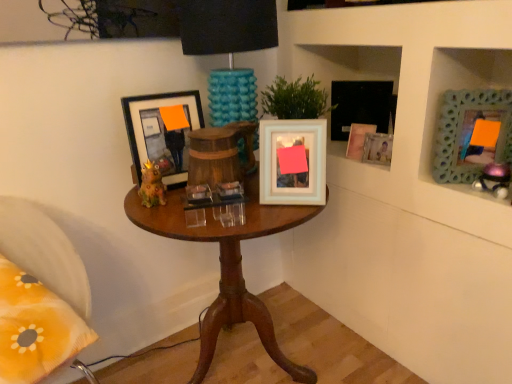
What do you see at coordinates (227, 26) in the screenshot?
I see `teal textured lampshade at center` at bounding box center [227, 26].

What is the approximate height of teal textured lampshade at center?

teal textured lampshade at center is 21.93 inches in height.

What is the approximate height of white glossy picture frame at center, arranged as the fifth picture frame when viewed from the right?

white glossy picture frame at center, arranged as the fifth picture frame when viewed from the right, is 28.22 centimeters tall.

Consider the image. Measure the distance between point (297, 193) and camera.

1.17 meters.

Where is `yellow fabric pillow at lower left`? This screenshot has width=512, height=384. yellow fabric pillow at lower left is located at coordinates (35, 328).

The image size is (512, 384). I want to click on matte white picture frame at upper right, the 3th picture frame viewed from the left, so click(x=358, y=140).

In order to face matte white picture frame at upper right, the 4th picture frame when ordered from right to left, should I rotate leftwards or rightwards?

You should look right and rotate roughly 13.861 degrees.

How much space does matte black picture frame at left, the 6th picture frame viewed from the right, occupy vertically?

11.04 inches.

Image resolution: width=512 pixels, height=384 pixels. What do you see at coordinates (151, 185) in the screenshot?
I see `matte ceramic frog at center, the first toy in the left-to-right sequence` at bounding box center [151, 185].

Locate an element on the screen. teal textured lampshade at center is located at coordinates (227, 26).

Which is more distant, [510,221] or [387,159]?

The point [387,159] is more distant.

From the image's perspective, is white textured cabinet at upper right above matte white picture frame at upper right, the second picture frame from the right?

No.

Is white textured cabinet at upper right looking in the opposite direction of matte white picture frame at upper right, which is the 5th picture frame in left-to-right order?

Yes, white textured cabinet at upper right is positioned with its back facing matte white picture frame at upper right, which is the 5th picture frame in left-to-right order.

Would you consider white textured cabinet at upper right to be distant from matte white picture frame at upper right, which is the 5th picture frame in left-to-right order?

No, white textured cabinet at upper right is not far away from matte white picture frame at upper right, which is the 5th picture frame in left-to-right order.

Which is closer, [239,285] or [161,201]?

The point [161,201] is in front.

Looking at their sizes, would you say wooden table at center is wider or thinner than matte ceramic frog at center, the first toy in the left-to-right sequence?

Clearly, wooden table at center has more width compared to matte ceramic frog at center, the first toy in the left-to-right sequence.

Does wooden table at center come in front of matte ceramic frog at center, arranged as the 2th toy when viewed from the right?

Yes, the depth of wooden table at center is less than that of matte ceramic frog at center, arranged as the 2th toy when viewed from the right.

Between yellow fabric pillow at lower left and matte black picture frame at left, the first picture frame positioned from the left, which one has larger size?

With larger size is yellow fabric pillow at lower left.

Between yellow fabric pillow at lower left and matte black picture frame at left, the first picture frame positioned from the left, which one has larger width?

yellow fabric pillow at lower left is wider.

Would you say yellow fabric pillow at lower left contains matte black picture frame at left, the first picture frame positioned from the left?

No.

Looking at this image, how far apart are yellow fabric pillow at lower left and matte black picture frame at left, the 6th picture frame viewed from the right?

yellow fabric pillow at lower left is 19.93 inches from matte black picture frame at left, the 6th picture frame viewed from the right.

In the scene shown: Which of these two, matte ceramic frog at center, arranged as the 2th toy when viewed from the right, or matte white picture frame at upper right, which is the 5th picture frame in left-to-right order, is smaller?

Smaller between the two is matte white picture frame at upper right, which is the 5th picture frame in left-to-right order.

Considering the sizes of objects matte ceramic frog at center, arranged as the 2th toy when viewed from the right, and matte white picture frame at upper right, the second picture frame from the right, in the image provided, who is shorter, matte ceramic frog at center, arranged as the 2th toy when viewed from the right, or matte white picture frame at upper right, the second picture frame from the right,?

Standing shorter between the two is matte white picture frame at upper right, the second picture frame from the right.

What are the coordinates of `toy to the left of matte white picture frame at upper right, the second picture frame from the right` in the screenshot? It's located at (151, 185).

Consider the image. Is the position of yellow fabric pillow at lower left less distant than that of matte ceramic frog at center, the first toy in the left-to-right sequence?

That is True.

Considering the relative sizes of yellow fabric pillow at lower left and matte ceramic frog at center, the first toy in the left-to-right sequence, in the image provided, is yellow fabric pillow at lower left smaller than matte ceramic frog at center, the first toy in the left-to-right sequence,?

Actually, yellow fabric pillow at lower left might be larger than matte ceramic frog at center, the first toy in the left-to-right sequence.

Can you confirm if yellow fabric pillow at lower left is positioned to the right of matte ceramic frog at center, arranged as the 2th toy when viewed from the right?

In fact, yellow fabric pillow at lower left is to the left of matte ceramic frog at center, arranged as the 2th toy when viewed from the right.

Who is smaller, white glossy picture frame at center, positioned as the second picture frame in left-to-right order, or metallic purple toy at upper right, placed as the first toy when sorted from right to left?

Smaller between the two is metallic purple toy at upper right, placed as the first toy when sorted from right to left.

From the image's perspective, which one is positioned higher, white glossy picture frame at center, positioned as the second picture frame in left-to-right order, or metallic purple toy at upper right, the second toy viewed from the left?

white glossy picture frame at center, positioned as the second picture frame in left-to-right order.

Considering the points (263, 188) and (499, 179), which point is behind, point (263, 188) or point (499, 179)?

The point (263, 188) is farther.

From the image's perspective, which is below, matte white picture frame at upper right, which is the 5th picture frame in left-to-right order, or wooden table at center?

From the image's view, wooden table at center is below.

Which is closer, (379,153) or (225,240)?

Point (379,153) is positioned farther from the camera compared to point (225,240).

Is matte white picture frame at upper right, which is the 5th picture frame in left-to-right order, looking in the opposite direction of wooden table at center?

matte white picture frame at upper right, which is the 5th picture frame in left-to-right order, is not turned away from wooden table at center.

In terms of width, does matte white picture frame at upper right, which is the 5th picture frame in left-to-right order, look wider or thinner when compared to wooden table at center?

In the image, matte white picture frame at upper right, which is the 5th picture frame in left-to-right order, appears to be more narrow than wooden table at center.

I want to click on picture frame that is the 4th one when counting backward from the white textured cabinet at upper right, so click(x=378, y=148).

Where is `table below the matte ceramic frog at center, the first toy in the left-to-right sequence (from the image's perspective)`? The width and height of the screenshot is (512, 384). table below the matte ceramic frog at center, the first toy in the left-to-right sequence (from the image's perspective) is located at coordinates pyautogui.click(x=228, y=266).

When comparing their distances from white glossy picture frame at center, positioned as the second picture frame in left-to-right order, does wooden table at center or matte white picture frame at upper right, which is the 5th picture frame in left-to-right order, seem closer?

wooden table at center lies closer to white glossy picture frame at center, positioned as the second picture frame in left-to-right order, than the other object.

Estimate the real-world distances between objects in this image. Which object is closer to matte white picture frame at upper right, the second picture frame from the right, matte black picture frame at upper right, which is the fourth picture frame in left-to-right order, or white textured cabinet at upper right?

Based on the image, matte black picture frame at upper right, which is the fourth picture frame in left-to-right order, appears to be nearer to matte white picture frame at upper right, the second picture frame from the right.

Based on the photo, based on their spatial positions, is matte black picture frame at left, the 6th picture frame viewed from the right, or matte ceramic frog at center, the first toy in the left-to-right sequence, further from green textured frame at upper right, the 1th picture frame when ordered from right to left?

matte ceramic frog at center, the first toy in the left-to-right sequence.

Which object lies further to the anchor point matte black picture frame at left, the first picture frame positioned from the left, metallic purple toy at upper right, placed as the first toy when sorted from right to left, or matte white picture frame at upper right, which is the 5th picture frame in left-to-right order?

Among the two, metallic purple toy at upper right, placed as the first toy when sorted from right to left, is located further to matte black picture frame at left, the first picture frame positioned from the left.

When comparing their distances from green textured frame at upper right, marked as the sixth picture frame in a left-to-right arrangement, does matte white picture frame at upper right, the 3th picture frame viewed from the left, or white textured cabinet at upper right seem further?

matte white picture frame at upper right, the 3th picture frame viewed from the left, lies further to green textured frame at upper right, marked as the sixth picture frame in a left-to-right arrangement, than the other object.

When comparing their distances from matte ceramic frog at center, arranged as the 2th toy when viewed from the right, does wooden table at center or matte black picture frame at left, the first picture frame positioned from the left, seem closer?

matte black picture frame at left, the first picture frame positioned from the left, is positioned closer to the anchor matte ceramic frog at center, arranged as the 2th toy when viewed from the right.

Which object lies further to the anchor point teal textured lampshade at center, metallic purple toy at upper right, placed as the first toy when sorted from right to left, or matte ceramic frog at center, the first toy in the left-to-right sequence?

metallic purple toy at upper right, placed as the first toy when sorted from right to left, is positioned further to the anchor teal textured lampshade at center.

From the image, which object appears to be nearer to green textured frame at upper right, the 1th picture frame when ordered from right to left, matte white picture frame at upper right, the 4th picture frame when ordered from right to left, or metallic purple toy at upper right, the second toy viewed from the left?

Based on the image, metallic purple toy at upper right, the second toy viewed from the left, appears to be nearer to green textured frame at upper right, the 1th picture frame when ordered from right to left.

Find the location of a particular element. Image resolution: width=512 pixels, height=384 pixels. table located between yellow fabric pillow at lower left and white glossy picture frame at center, positioned as the second picture frame in left-to-right order, in the left-right direction is located at coordinates (228, 266).

Locate an element on the screen. The height and width of the screenshot is (384, 512). toy between yellow fabric pillow at lower left and white glossy picture frame at center, positioned as the second picture frame in left-to-right order is located at coordinates (151, 185).

Identify the location of table located between yellow fabric pillow at lower left and matte white picture frame at upper right, which is the 5th picture frame in left-to-right order, in the left-right direction. This screenshot has width=512, height=384. (228, 266).

The height and width of the screenshot is (384, 512). I want to click on table located between matte ceramic frog at center, the first toy in the left-to-right sequence, and green textured frame at upper right, marked as the sixth picture frame in a left-to-right arrangement, in the left-right direction, so click(228, 266).